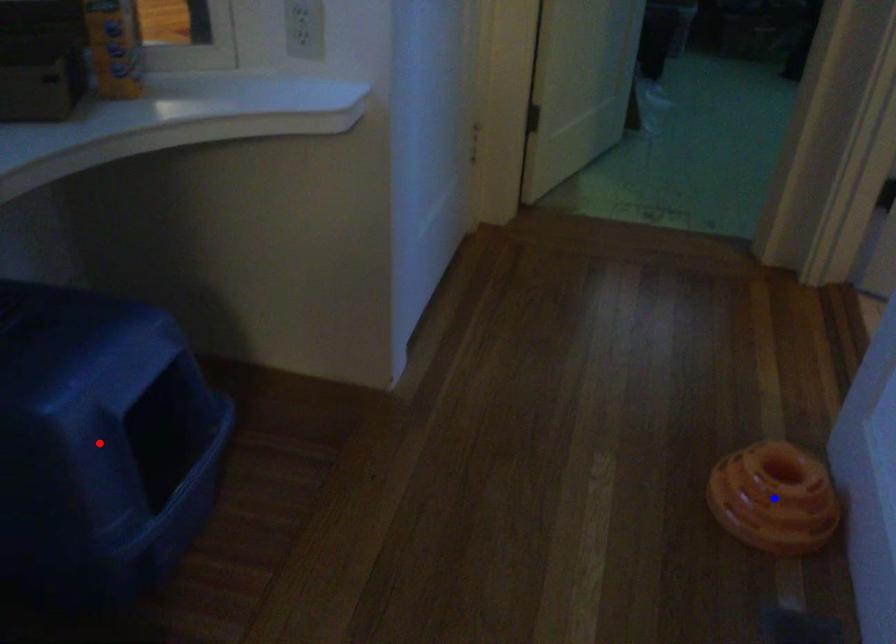
Question: In the image, two points are highlighted. Which point is nearer to the camera? Reply with the corresponding letter.

Choices:
 (A) blue point
 (B) red point

Answer: (B)